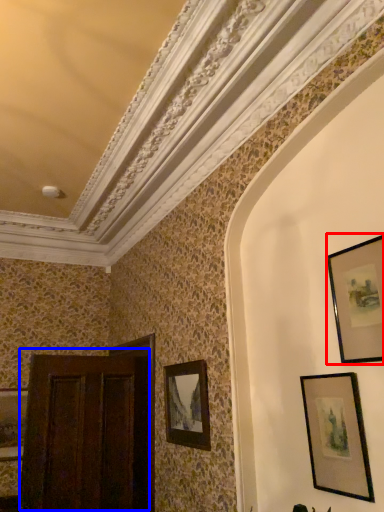
Question: Which object appears farthest to the camera in this image, picture frame (highlighted by a red box) or door (highlighted by a blue box)?

Choices:
 (A) picture frame
 (B) door

Answer: (B)